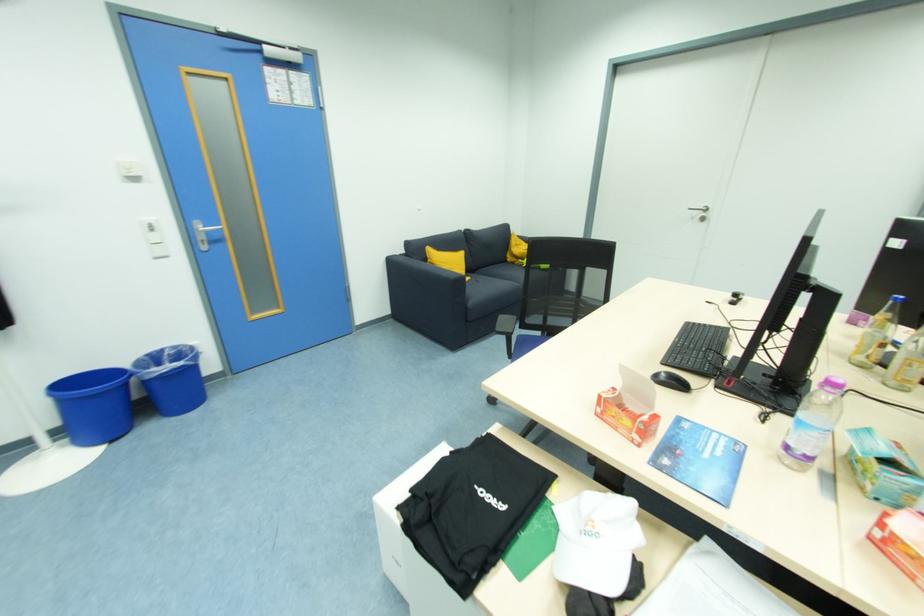
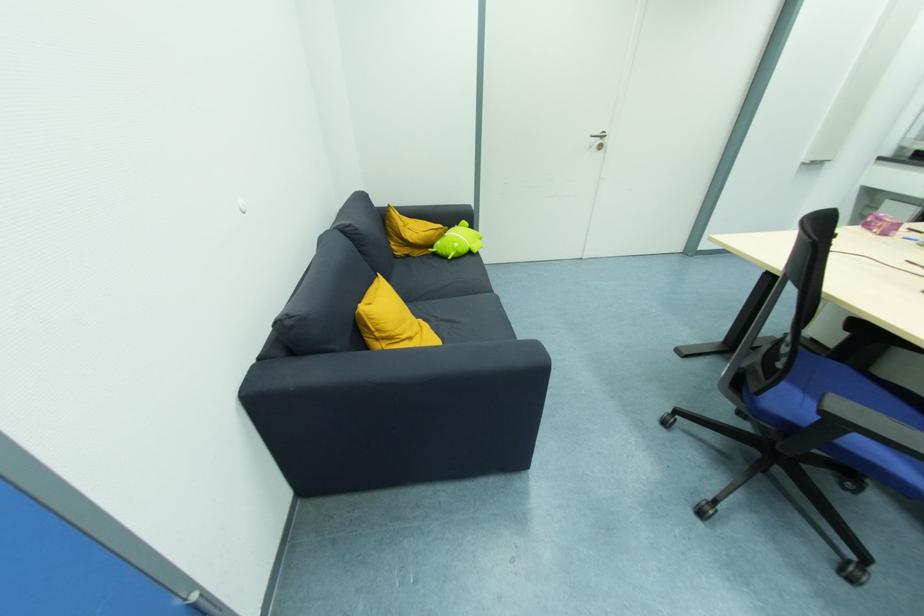
Find the pixel in the second image that matches the point at 706,221 in the first image.

(603, 148)